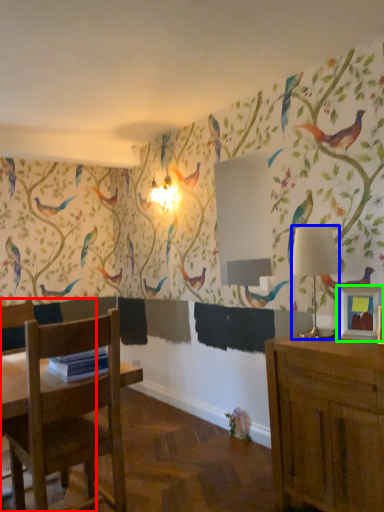
Question: Based on their relative distances, which object is nearer to chair (highlighted by a red box)? Choose from lamp (highlighted by a blue box) and picture frame (highlighted by a green box).

Choices:
 (A) lamp
 (B) picture frame

Answer: (A)